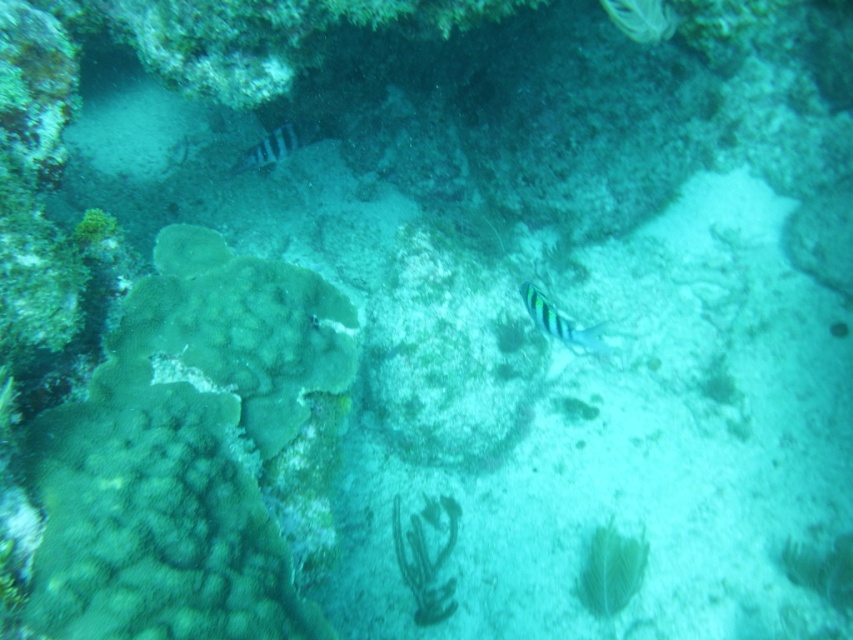
Can you confirm if striped matte fish at center is shorter than striped blue-green fish at upper left?

Indeed, striped matte fish at center has a lesser height compared to striped blue-green fish at upper left.

Does striped matte fish at center appear over striped blue-green fish at upper left?

No.

Consider the image. Who is more forward, (564,316) or (244,150)?

Point (244,150) is more forward.

Locate an element on the screen. The height and width of the screenshot is (640, 853). striped matte fish at center is located at coordinates (560, 323).